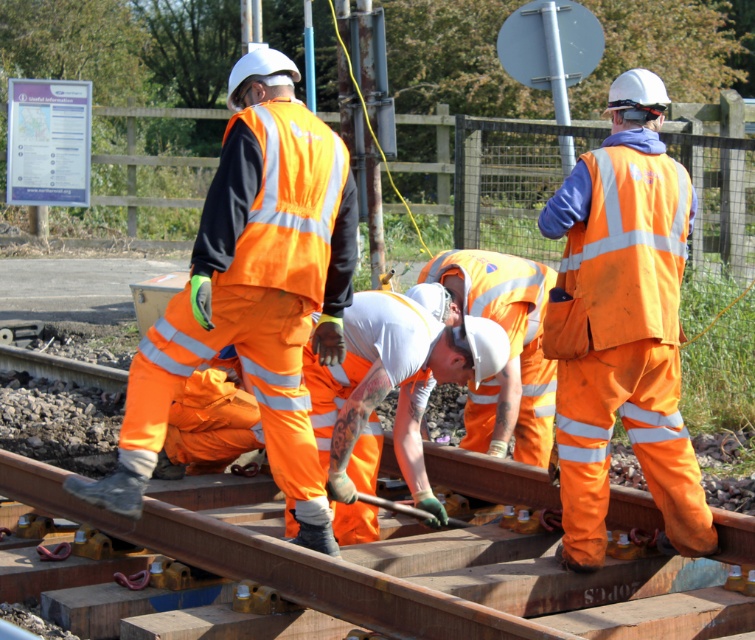
Question: Which of the following is the farthest from the observer?

Choices:
 (A) (337, 304)
 (B) (639, 120)
 (C) (643, 164)
 (D) (156, 385)

Answer: (A)

Question: Which object is positioned farthest from the high-visibility orange reflective vest at center?

Choices:
 (A) high visibility orange uniform at center
 (B) high-visibility fabric safety vest at right

Answer: (A)

Question: Which point appears closest to the camera in this image?

Choices:
 (A) (223, 163)
 (B) (599, 284)
 (C) (276, 209)
 (D) (660, 374)

Answer: (C)

Question: From the image, what is the correct spatial relationship of high-visibility orange reflective vest at center in relation to high-visibility orange safety vest at center?

Choices:
 (A) right
 (B) left

Answer: (B)

Question: Can you confirm if high-visibility orange safety vest at center is bigger than high-visibility fabric safety vest at right?

Choices:
 (A) yes
 (B) no

Answer: (A)

Question: Does high visibility orange uniform at center appear over high-visibility fabric safety vest at right?

Choices:
 (A) yes
 (B) no

Answer: (B)